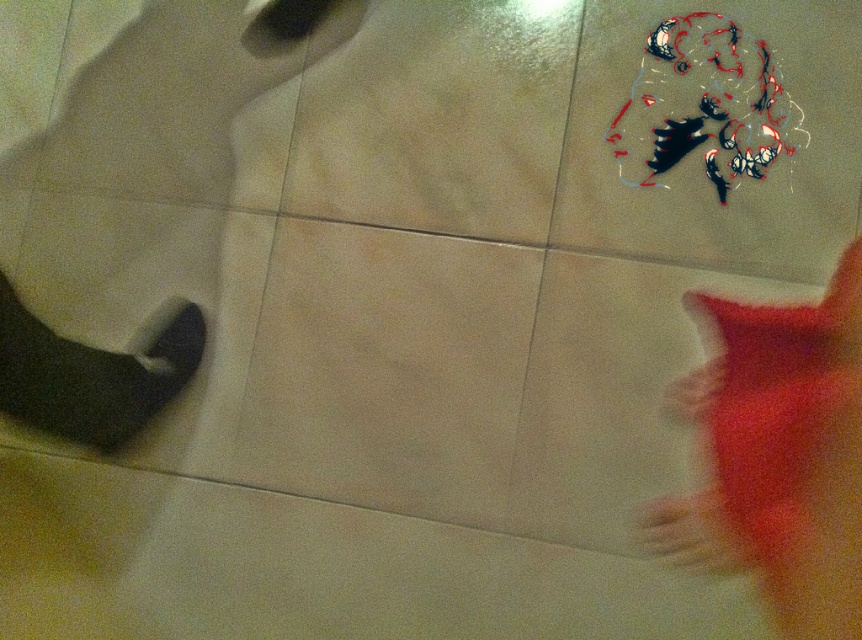
You are standing on the beige matte tile at center and want to walk towards the matte gray tile at lower left. Which direction should you move to reach it?

The beige matte tile at center is in front of the matte gray tile at lower left, so to reach the matte gray tile at lower left, you should move backward.